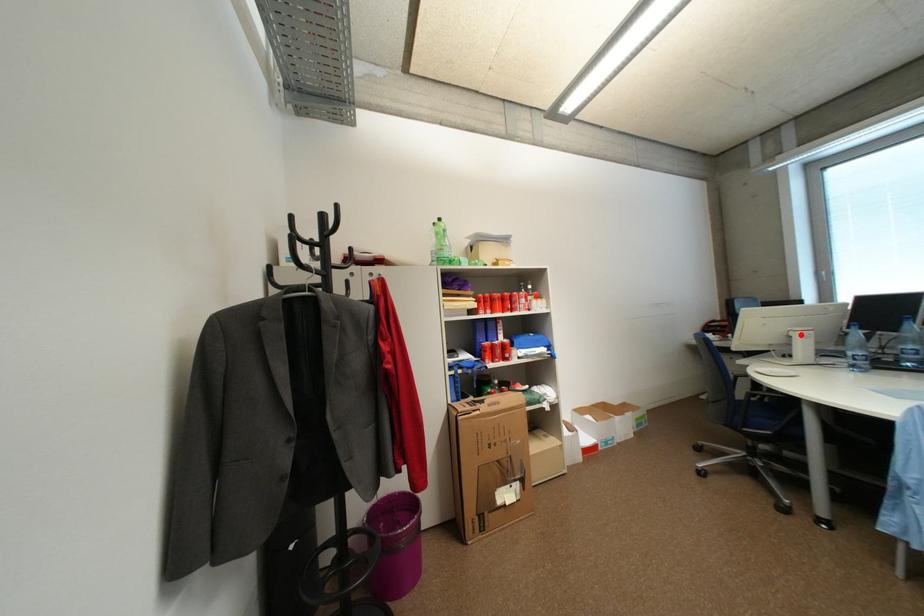
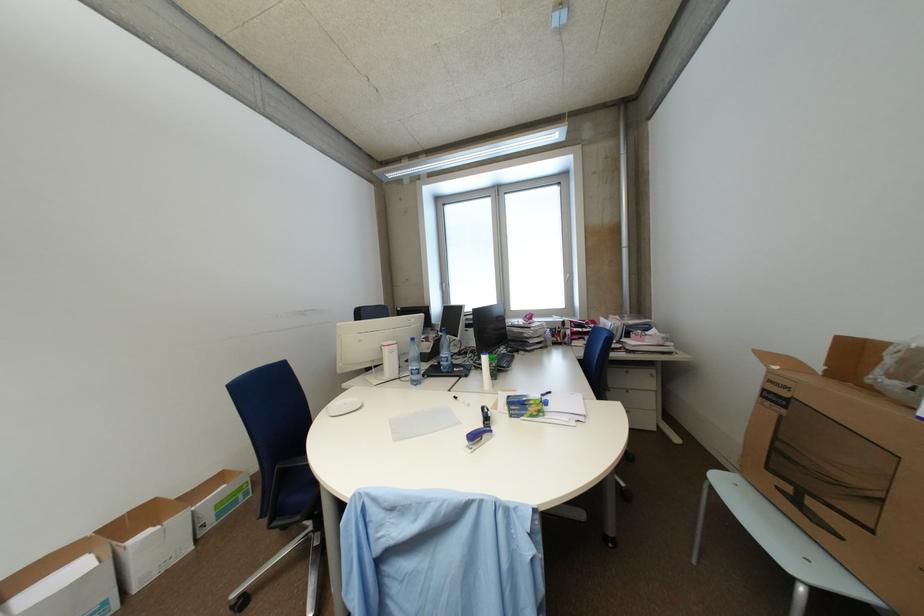
Question: I am providing you with two images of the same scene from different viewpoints. Given a red point in image1, look at the same physical point in image2. Is it:

Choices:
 (A) Closer to the viewpoint
 (B) Farther from the viewpoint

Answer: (B)